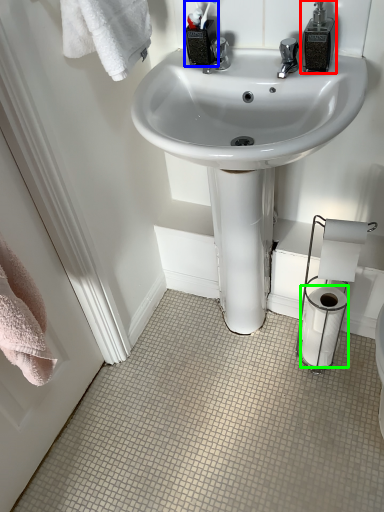
Question: Estimate the real-world distances between objects in this image. Which object is closer to soap dispenser (highlighted by a red box), toiletry (highlighted by a blue box) or toilet paper (highlighted by a green box)?

Choices:
 (A) toiletry
 (B) toilet paper

Answer: (A)